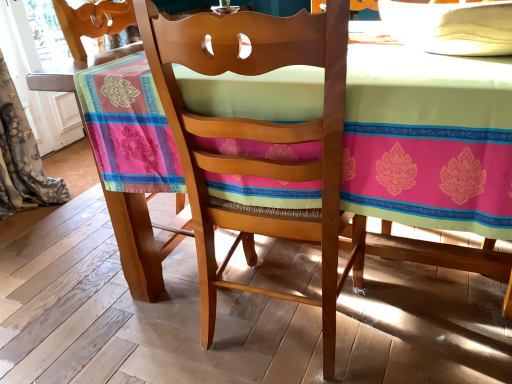
Question: Is wooden chair at center at the left side of floral fabric curtain at left?

Choices:
 (A) no
 (B) yes

Answer: (A)

Question: Can you confirm if wooden chair at center is thinner than floral fabric curtain at left?

Choices:
 (A) no
 (B) yes

Answer: (A)

Question: Is wooden chair at center oriented towards floral fabric curtain at left?

Choices:
 (A) yes
 (B) no

Answer: (B)

Question: From a real-world perspective, is wooden chair at center on floral fabric curtain at left?

Choices:
 (A) yes
 (B) no

Answer: (A)

Question: Is wooden chair at center far from floral fabric curtain at left?

Choices:
 (A) yes
 (B) no

Answer: (A)

Question: Considering the positions of wooden table at center and floral fabric curtain at left in the image, is wooden table at center taller or shorter than floral fabric curtain at left?

Choices:
 (A) tall
 (B) short

Answer: (B)

Question: From a real-world perspective, is wooden table at center above or below floral fabric curtain at left?

Choices:
 (A) below
 (B) above

Answer: (A)

Question: Based on their sizes in the image, would you say wooden table at center is bigger or smaller than floral fabric curtain at left?

Choices:
 (A) big
 (B) small

Answer: (A)

Question: From the image's perspective, is wooden table at center located above or below floral fabric curtain at left?

Choices:
 (A) below
 (B) above

Answer: (A)

Question: Is floral fabric curtain at left taller or shorter than wooden chair at center?

Choices:
 (A) short
 (B) tall

Answer: (B)

Question: Does point (13, 210) appear closer or farther from the camera than point (260, 160)?

Choices:
 (A) farther
 (B) closer

Answer: (A)

Question: Considering the positions of floral fabric curtain at left and wooden chair at center in the image, is floral fabric curtain at left wider or thinner than wooden chair at center?

Choices:
 (A) thin
 (B) wide

Answer: (A)

Question: From a real-world perspective, is floral fabric curtain at left physically located above or below wooden chair at center?

Choices:
 (A) above
 (B) below

Answer: (B)

Question: Would you say wooden chair at center is inside or outside wooden table at center?

Choices:
 (A) inside
 (B) outside

Answer: (A)

Question: Considering the positions of wooden chair at center and wooden table at center in the image, is wooden chair at center bigger or smaller than wooden table at center?

Choices:
 (A) big
 (B) small

Answer: (B)